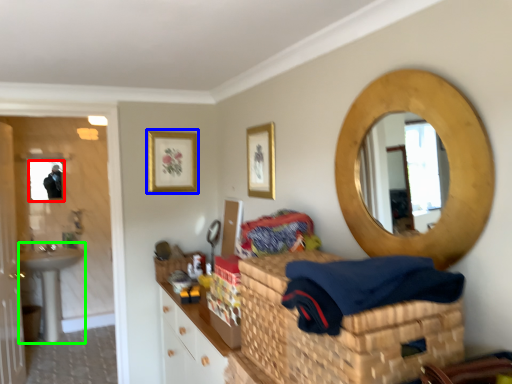
Question: Which object is the closest to the mirror (highlighted by a red box)? Choose among these: picture frame (highlighted by a blue box) or sink (highlighted by a green box).

Choices:
 (A) picture frame
 (B) sink

Answer: (B)